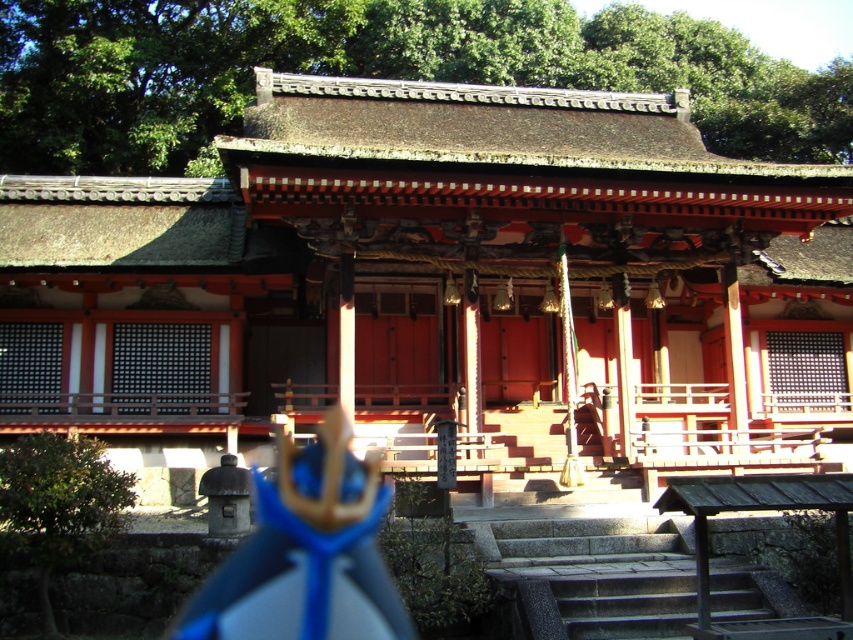
Question: Can you confirm if matte red shrine at center is positioned to the right of gray stone stairs at center?

Choices:
 (A) no
 (B) yes

Answer: (A)

Question: Does matte red shrine at center appear on the right side of gray stone stairs at center?

Choices:
 (A) no
 (B) yes

Answer: (A)

Question: Does matte red shrine at center appear on the left side of gray stone stairs at center?

Choices:
 (A) no
 (B) yes

Answer: (B)

Question: Which point is farther to the camera?

Choices:
 (A) gray stone stairs at center
 (B) matte red shrine at center

Answer: (B)